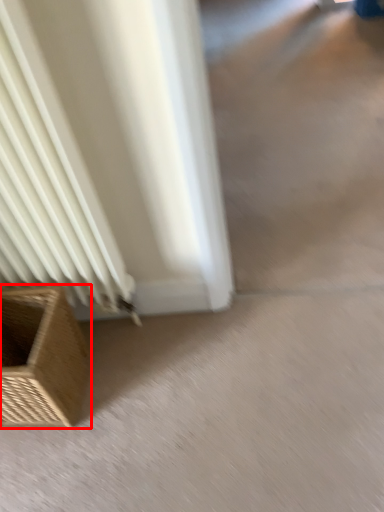
Question: From the image, what is the correct spatial relationship of furniture (annotated by the red box) in relation to concrete?

Choices:
 (A) left
 (B) right

Answer: (A)